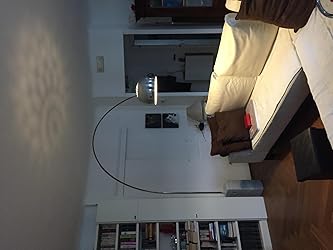
What are the coordinates of `couch` in the screenshot? It's located at (272, 91).